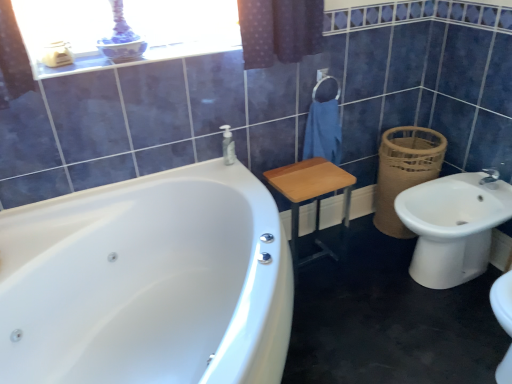
Where is `spots to the right of wooden stool at center`? spots to the right of wooden stool at center is located at coordinates (360, 259).